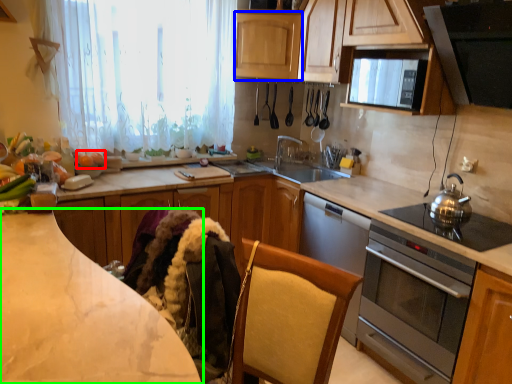
Question: Which is farther away from food (highlighted by a red box)? cabinetry (highlighted by a blue box) or countertop (highlighted by a green box)?

Choices:
 (A) cabinetry
 (B) countertop

Answer: (B)